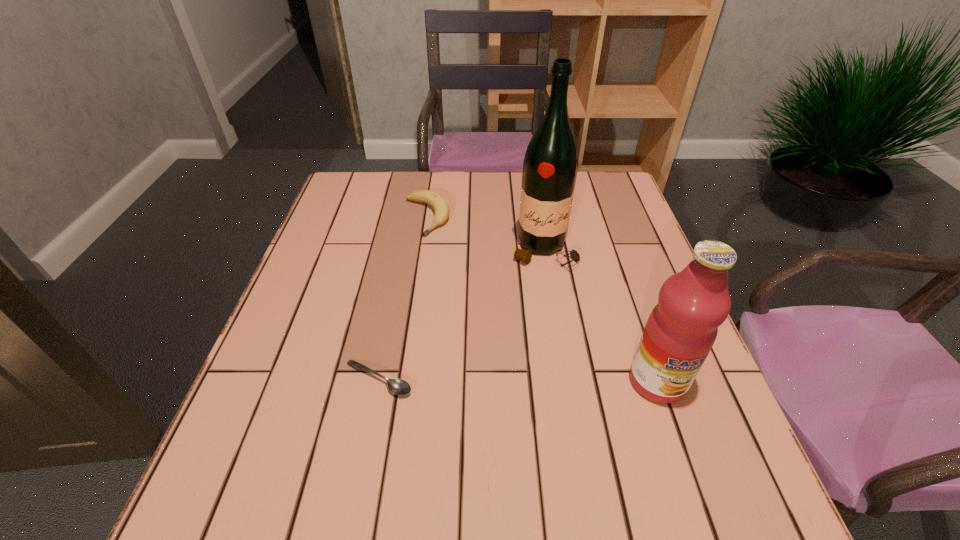
Where is `blank area located on the surface of the wine bottle`? The width and height of the screenshot is (960, 540). blank area located on the surface of the wine bottle is located at coordinates (550, 342).

Locate an element on the screen. The width and height of the screenshot is (960, 540). free region located 0.240m on the surface of the wine bottle is located at coordinates pos(551,350).

Image resolution: width=960 pixels, height=540 pixels. In order to click on vacant space located 0.380m on the surface of the wine bottle in this screenshot , I will do `click(555, 410)`.

Identify the location of object present at the far edge. (437, 201).

Identify the location of object positioned at the right edge. The height and width of the screenshot is (540, 960). (681, 329).

Where is `vacant space at the far edge of the desktop`? The image size is (960, 540). vacant space at the far edge of the desktop is located at coordinates (401, 174).

In the image, there is a desktop. Where is `free space at the left edge`? The image size is (960, 540). free space at the left edge is located at coordinates (340, 221).

Where is `vacant space at the right edge`? This screenshot has height=540, width=960. vacant space at the right edge is located at coordinates (618, 290).

The width and height of the screenshot is (960, 540). In the image, there is a desktop. Find the location of `vacant space at the far left corner`. vacant space at the far left corner is located at coordinates (363, 211).

Locate an element on the screen. vacant space at the near left corner is located at coordinates (310, 454).